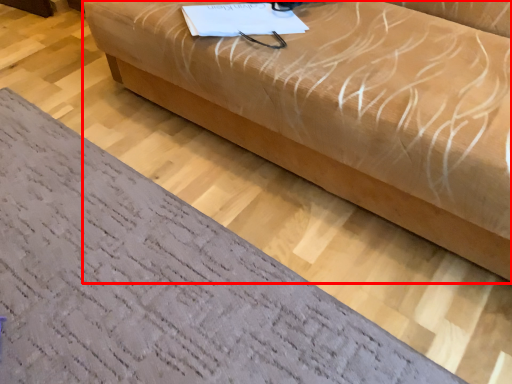
Question: From the image's perspective, considering the relative positions of studio couch (annotated by the red box) and furniture in the image provided, where is studio couch (annotated by the red box) located with respect to the staircase?

Choices:
 (A) above
 (B) below

Answer: (A)